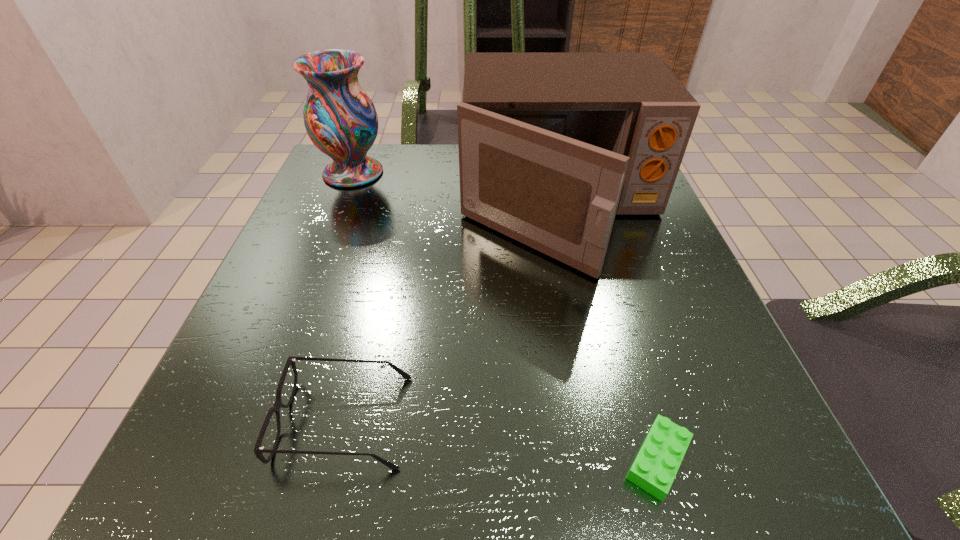
Where is `vase`? The height and width of the screenshot is (540, 960). vase is located at coordinates (340, 119).

At what (x,y) coordinates should I click in order to perform the action: click on microwave oven. Please return your answer as a coordinate pair (x, y). Image resolution: width=960 pixels, height=540 pixels. Looking at the image, I should click on (552, 146).

This screenshot has width=960, height=540. In order to click on spectacles in this screenshot , I will do `click(258, 450)`.

Locate an element on the screen. The image size is (960, 540). Lego is located at coordinates (656, 465).

Where is `vacant area located 0.100m on the right of the vase`? vacant area located 0.100m on the right of the vase is located at coordinates (430, 173).

Locate an element on the screen. The height and width of the screenshot is (540, 960). free location located with the door open on the front of the microwave oven is located at coordinates (589, 343).

What are the coordinates of `free space located 0.180m with the lenses facing outward on the spectacles` in the screenshot? It's located at (547, 421).

Where is `blank area located on the left of the shortest object`? blank area located on the left of the shortest object is located at coordinates (362, 460).

Locate an element on the screen. vase positioned at the far edge is located at coordinates (340, 119).

Find the location of a particular element. The height and width of the screenshot is (540, 960). microwave oven that is at the far edge is located at coordinates (552, 146).